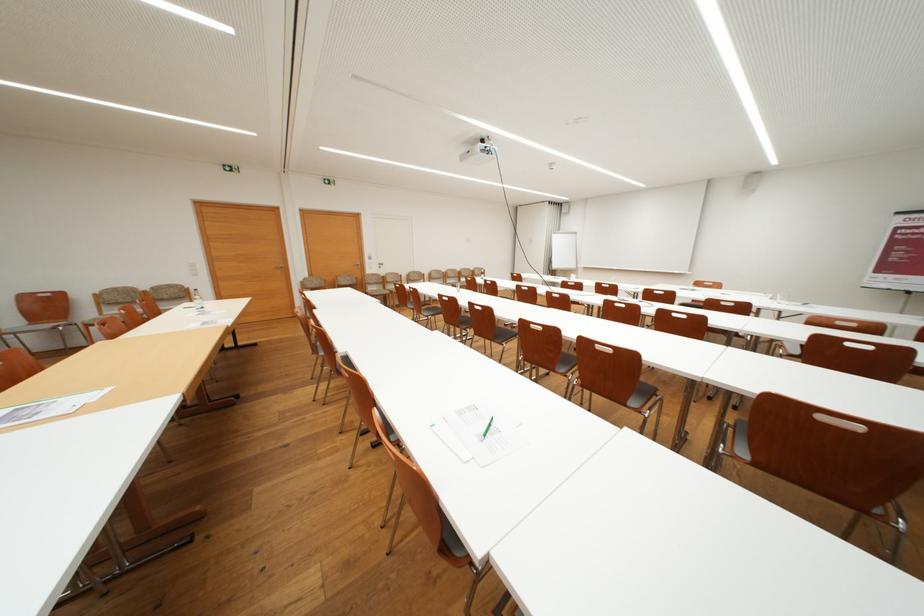
I want to click on white door handle, so click(247, 257).